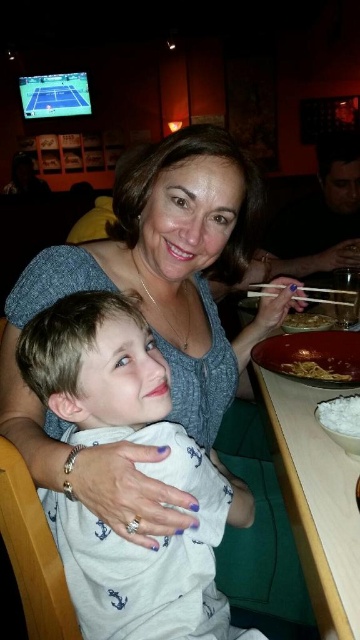
You are a waiter in a restaurant and need to place a small plate between the wooden chopsticks at upper center and the brown matte bowl at center. Which object should you place the plate closer to to ensure it doesn t fall over?

The wooden chopsticks at upper center is much taller than the brown matte bowl at center, so placing the plate closer to the brown matte bowl at center would provide a more stable base to prevent it from tipping over.

You are a restaurant server who just brought a meal to the table. You see the wooden chopsticks at upper center and the brown matte bowl at center. Which item should you hand to the adult holding the child?

You should hand the brown matte bowl at center to the adult holding the child because the wooden chopsticks at upper center are larger and might be harder for the adult to manage while holding the child.